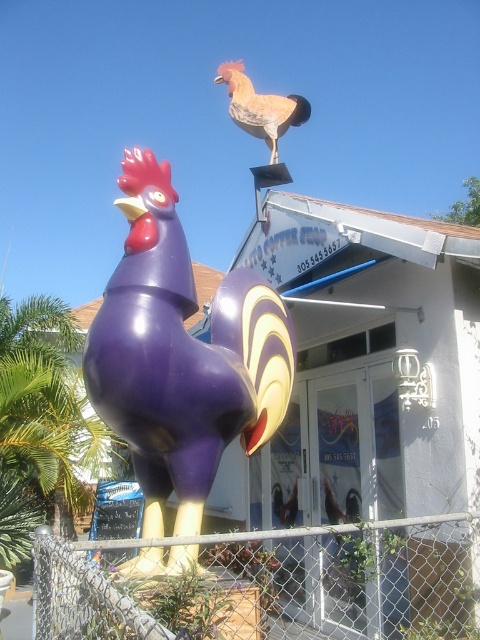
Measure the distance between point (146, 321) and camera.

The distance of point (146, 321) from camera is 3.36 meters.

Is purple glossy rooster at lower left behind matte orange rooster at upper center?

No, it is in front of matte orange rooster at upper center.

Identify the location of purple glossy rooster at lower left. (181, 355).

Locate an element on the screen. purple glossy rooster at lower left is located at coordinates (181, 355).

Describe the element at coordinates (181, 355) in the screenshot. I see `purple glossy rooster at lower left` at that location.

Can you confirm if purple glossy rooster at lower left is positioned to the right of chain link fence at lower center?

No, purple glossy rooster at lower left is not to the right of chain link fence at lower center.

Is point (162, 234) closer to camera compared to point (155, 540)?

No, it is behind (155, 540).

Find the location of `purple glossy rooster at lower left`. purple glossy rooster at lower left is located at coordinates (181, 355).

Who is more forward, (x=218, y=627) or (x=256, y=132)?

Positioned in front is point (x=218, y=627).

Which is more to the left, chain link fence at lower center or matte orange rooster at upper center?

From the viewer's perspective, matte orange rooster at upper center appears more on the left side.

Image resolution: width=480 pixels, height=640 pixels. Identify the location of chain link fence at lower center. (276, 584).